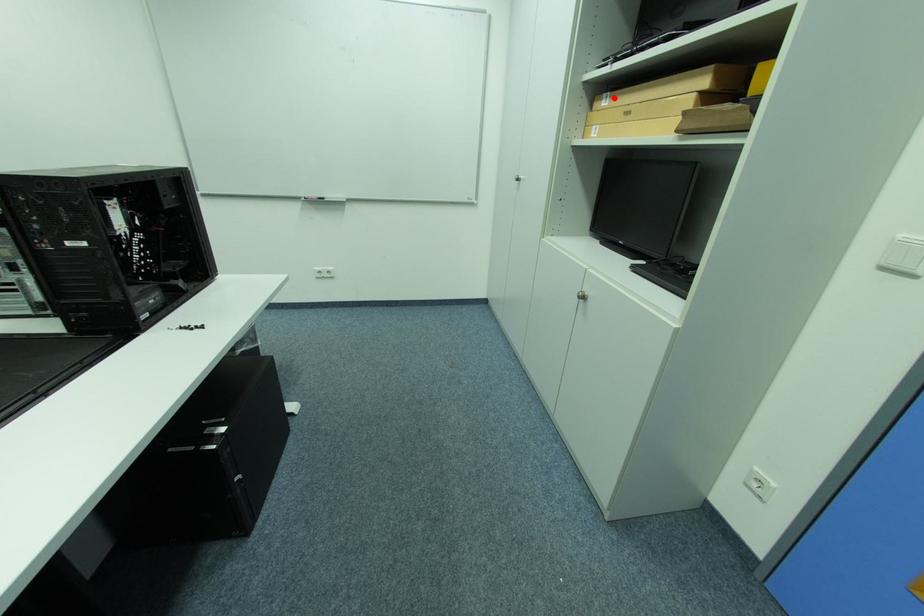
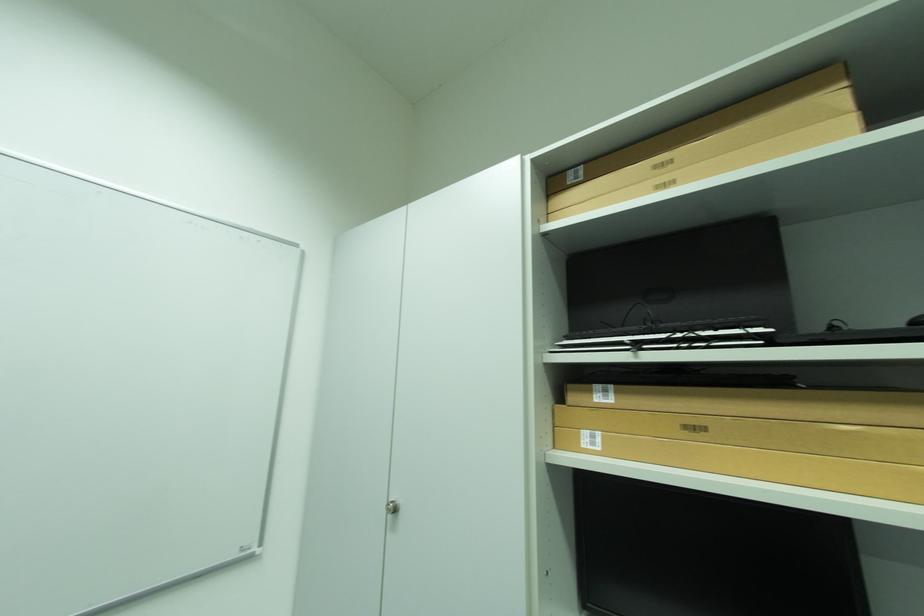
Find the pixel in the second image that matches the highlighted location in the first image.

(614, 392)